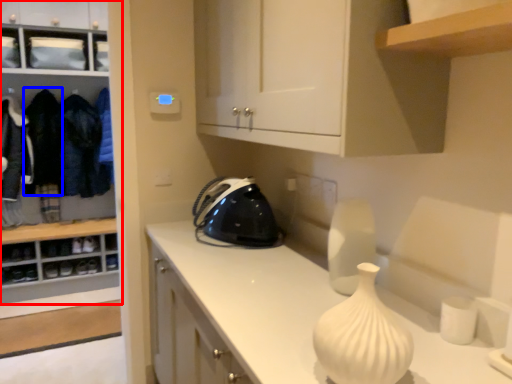
Question: Which object appears farthest to the camera in this image, cabinetry (highlighted by a red box) or clothing (highlighted by a blue box)?

Choices:
 (A) cabinetry
 (B) clothing

Answer: (B)